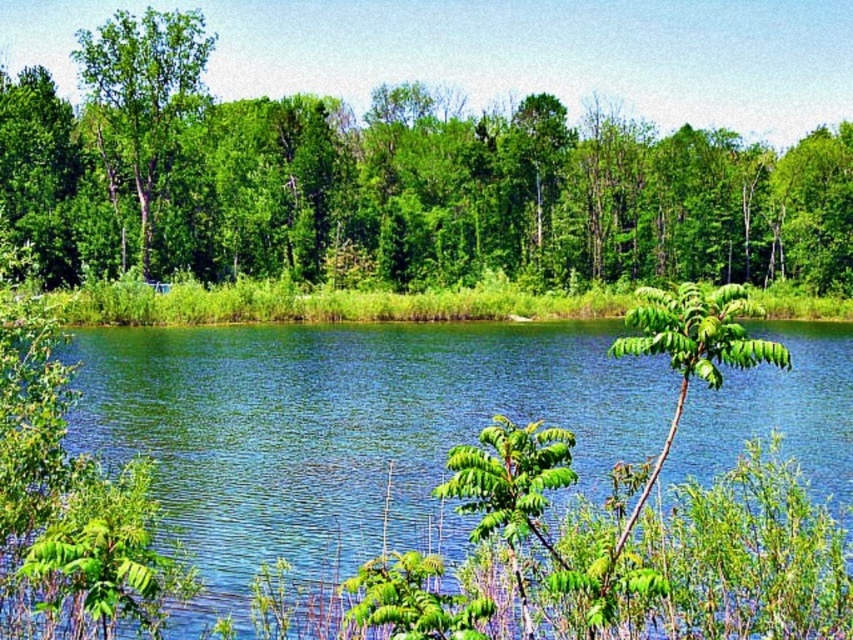
Who is more forward, [344,144] or [103,125]?

Point [103,125]

Locate an element on the screen. green leafy tree at upper center is located at coordinates (431, 145).

This screenshot has width=853, height=640. I want to click on green leafy tree at upper center, so click(x=431, y=145).

Is green leafy tree at upper center in front of blue water at center?

No, it is behind blue water at center.

The height and width of the screenshot is (640, 853). Find the location of `green leafy tree at upper center`. green leafy tree at upper center is located at coordinates [x=431, y=145].

What are the coordinates of `green leafy tree at upper center` in the screenshot? It's located at (431, 145).

Is blue water at center to the left of green leafy tree at upper left from the viewer's perspective?

Incorrect, blue water at center is not on the left side of green leafy tree at upper left.

Which is more to the right, blue water at center or green leafy tree at upper left?

blue water at center

In order to click on blue water at center in this screenshot , I will do `click(341, 420)`.